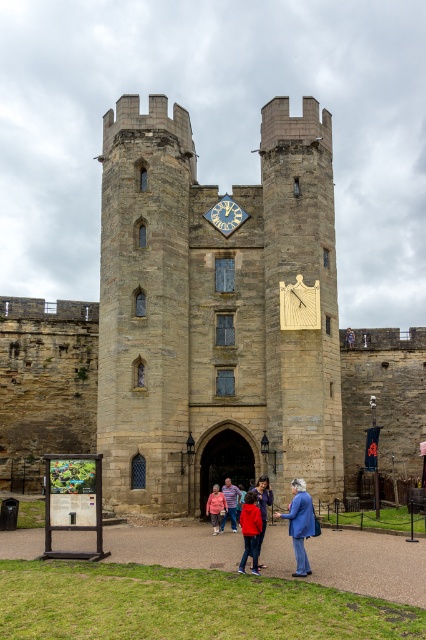
Question: Which point is closer to the camera taking this photo?

Choices:
 (A) (230, 472)
 (B) (218, 524)

Answer: (B)

Question: Among these objects, which one is farthest from the camera?

Choices:
 (A) blue fabric coat at lower center
 (B) matte red jacket at center
 (C) pink fabric jacket at center
 (D) red shirt at center

Answer: (C)

Question: Can you confirm if matte red jacket at center is positioned above pink fabric jacket at center?

Choices:
 (A) no
 (B) yes

Answer: (B)

Question: Observing the image, what is the correct spatial positioning of brown stone castle at center in reference to stone archway at center?

Choices:
 (A) right
 (B) left

Answer: (B)

Question: Which point appears farthest from the camera in this image?

Choices:
 (A) (109, 435)
 (B) (235, 502)
 (C) (207, 506)

Answer: (A)

Question: Is blue fabric coat at lower center positioned behind red fleece jacket at center?

Choices:
 (A) yes
 (B) no

Answer: (B)